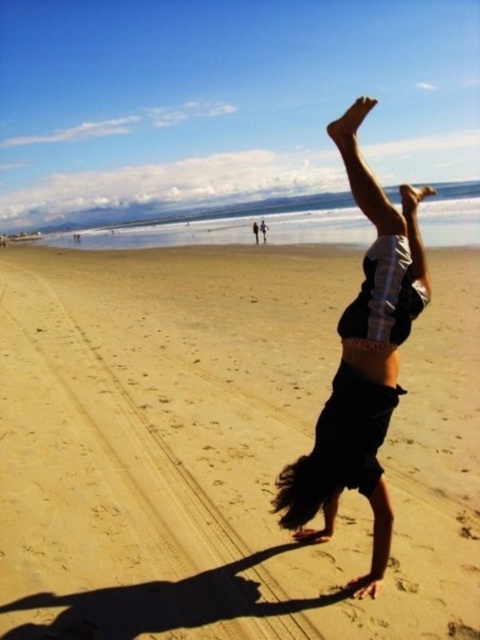
Which is above, sandy yellow at center or dark brown hair at center?

dark brown hair at center is above.

Which is behind, point (78, 448) or point (370, 285)?

Point (78, 448)

Between point (131, 451) and point (369, 371), which one is positioned behind?

The point (131, 451) is more distant.

Where is `sandy yellow at center`? The height and width of the screenshot is (640, 480). sandy yellow at center is located at coordinates (218, 449).